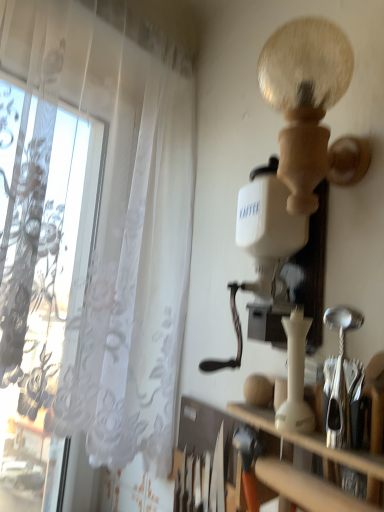
Question: From the image's perspective, is wooden at right under white sheer curtain at left?

Choices:
 (A) yes
 (B) no

Answer: (A)

Question: Is wooden at right facing towards white sheer curtain at left?

Choices:
 (A) yes
 (B) no

Answer: (B)

Question: Considering the relative positions of wooden at right and white sheer curtain at left in the image provided, is wooden at right to the left of white sheer curtain at left from the viewer's perspective?

Choices:
 (A) no
 (B) yes

Answer: (A)

Question: Is wooden at right taller than white sheer curtain at left?

Choices:
 (A) yes
 (B) no

Answer: (B)

Question: From a real-world perspective, does wooden at right sit lower than white sheer curtain at left?

Choices:
 (A) yes
 (B) no

Answer: (A)

Question: Does wooden at right have a lesser width compared to white sheer curtain at left?

Choices:
 (A) yes
 (B) no

Answer: (A)

Question: Is white sheer curtain at left oriented towards wooden at right?

Choices:
 (A) no
 (B) yes

Answer: (B)

Question: Is white sheer curtain at left bigger than wooden at right?

Choices:
 (A) yes
 (B) no

Answer: (A)

Question: Is white sheer curtain at left next to wooden at right and touching it?

Choices:
 (A) yes
 (B) no

Answer: (B)

Question: Can you confirm if white sheer curtain at left is positioned to the right of wooden at right?

Choices:
 (A) no
 (B) yes

Answer: (A)

Question: Is there a large distance between white sheer curtain at left and wooden at right?

Choices:
 (A) yes
 (B) no

Answer: (B)

Question: Is white sheer curtain at left at the left side of wooden at right?

Choices:
 (A) yes
 (B) no

Answer: (A)

Question: Based on their sizes in the image, would you say wooden at right is bigger or smaller than white sheer curtain at left?

Choices:
 (A) big
 (B) small

Answer: (B)